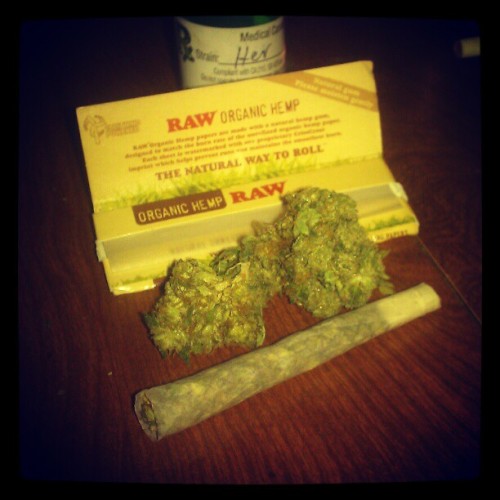
Identify the location of table. Image resolution: width=500 pixels, height=500 pixels. (369, 416).